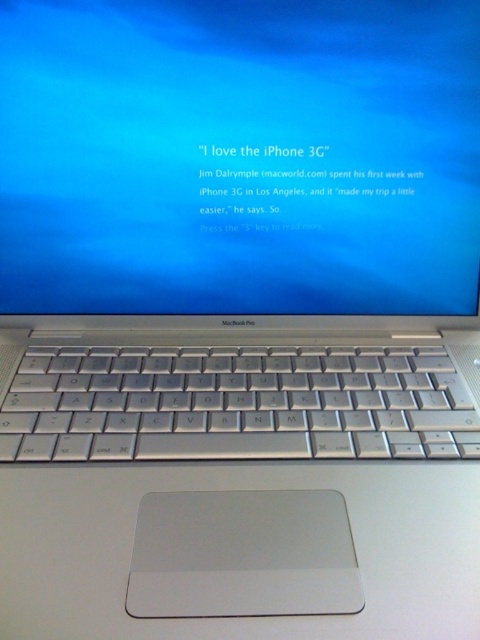
Where is the satin silver screen at center located in the image?

The satin silver screen at center is located at point (240, 156).

Looking at this image, you are a graphic designer working on a project that requires adjusting the height of two elements on your MacBook Pro. You need to ensure that the element representing the screen is taller than the keyboard element. Given the current setup, does the satin silver screen at center meet this requirement when compared to the silver metallic keyboard at center?

Yes, the satin silver screen at center has a greater height compared to the silver metallic keyboard at center, so it meets the requirement.

You are a graphic designer working on a project that requires a large workspace. You have a MacBook Pro with a satin silver screen at center and a silver metallic keyboard at center. Which component would you adjust to maximize your workspace area?

The satin silver screen at center has a larger size compared to the silver metallic keyboard at center, so adjusting the screen would allow for a larger workspace area.